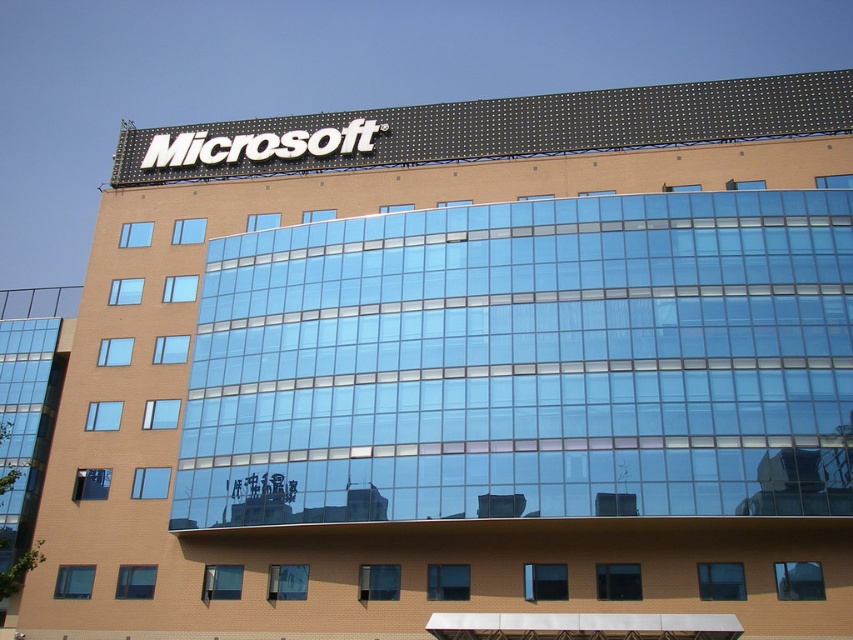
Can you confirm if transparent glass building at center is positioned below white sign at upper center?

Yes, transparent glass building at center is below white sign at upper center.

Does transparent glass building at center appear on the left side of white sign at upper center?

No, transparent glass building at center is not to the left of white sign at upper center.

Does point (804, 364) come farther from viewer compared to point (367, 160)?

No, (804, 364) is in front of (367, 160).

Where is `transparent glass building at center`? Image resolution: width=853 pixels, height=640 pixels. transparent glass building at center is located at coordinates (527, 364).